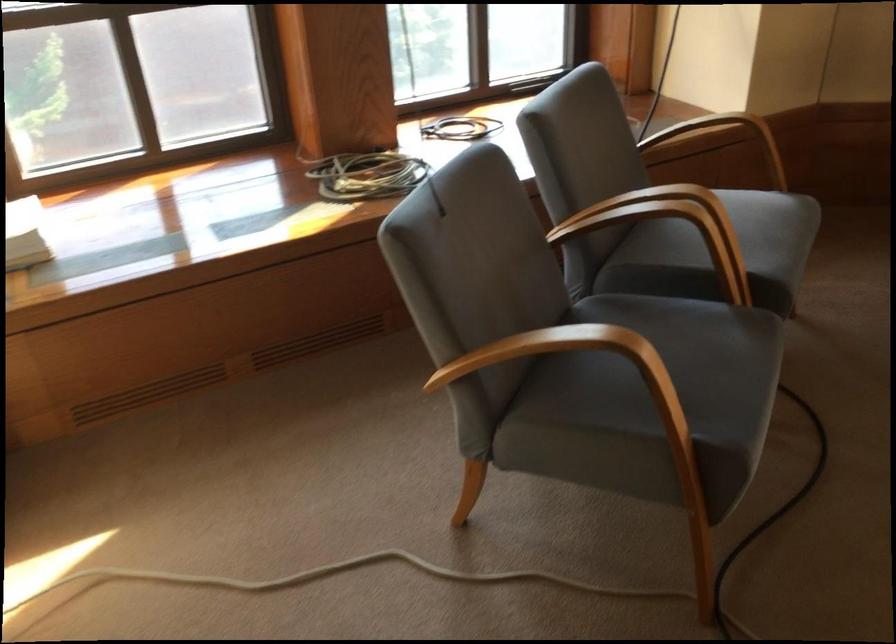
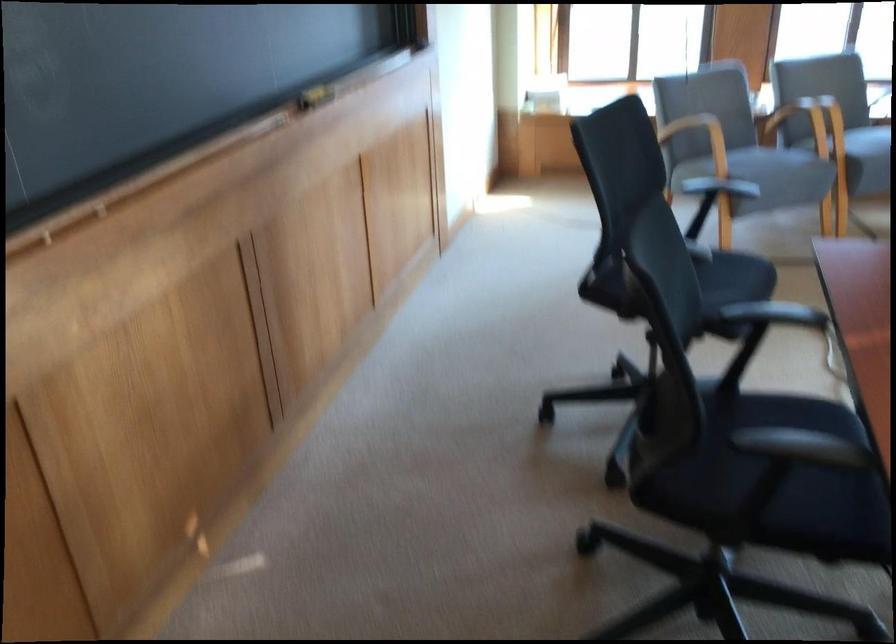
Locate, in the second image, the point that corresponds to the point at 764,448 in the first image.

(769, 172)